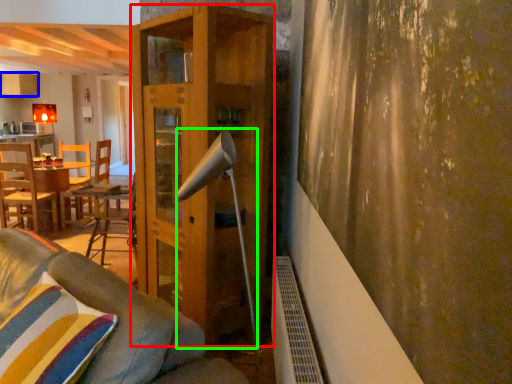
Question: Which object is the closest to the shelf (highlighted by a red box)? Choose among these: cabinetry (highlighted by a blue box) or lamp (highlighted by a green box).

Choices:
 (A) cabinetry
 (B) lamp

Answer: (B)